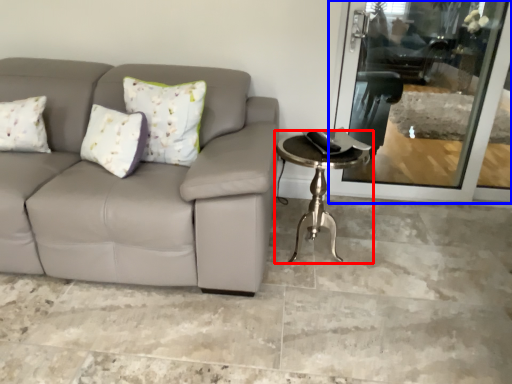
Question: Which object is further to the camera taking this photo, table (highlighted by a red box) or screen door (highlighted by a blue box)?

Choices:
 (A) table
 (B) screen door

Answer: (B)